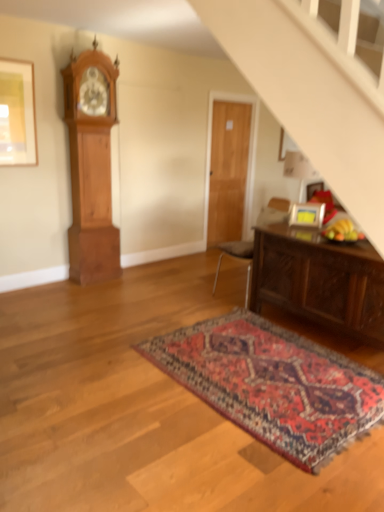
Question: Considering the relative positions of wooden grandfather clock at left and dark brown wooden table at lower right in the image provided, is wooden grandfather clock at left to the left of dark brown wooden table at lower right from the viewer's perspective?

Choices:
 (A) no
 (B) yes

Answer: (B)

Question: Is wooden grandfather clock at left completely or partially outside of dark brown wooden table at lower right?

Choices:
 (A) no
 (B) yes

Answer: (B)

Question: Is wooden grandfather clock at left far from dark brown wooden table at lower right?

Choices:
 (A) yes
 (B) no

Answer: (A)

Question: Does wooden grandfather clock at left have a larger size compared to dark brown wooden table at lower right?

Choices:
 (A) yes
 (B) no

Answer: (B)

Question: Is wooden grandfather clock at left aimed at dark brown wooden table at lower right?

Choices:
 (A) yes
 (B) no

Answer: (B)

Question: Looking at their shapes, would you say matte gold picture frame at upper left, positioned as the first picture frame in left-to-right order, is wider or thinner than dark brown wooden table at lower right?

Choices:
 (A) wide
 (B) thin

Answer: (B)

Question: From a real-world perspective, is matte gold picture frame at upper left, positioned as the first picture frame in left-to-right order, physically located above or below dark brown wooden table at lower right?

Choices:
 (A) below
 (B) above

Answer: (B)

Question: In terms of height, does matte gold picture frame at upper left, positioned as the first picture frame in left-to-right order, look taller or shorter compared to dark brown wooden table at lower right?

Choices:
 (A) tall
 (B) short

Answer: (A)

Question: Considering their positions, is matte gold picture frame at upper left, which appears as the 1th picture frame when viewed from the top, located in front of or behind dark brown wooden table at lower right?

Choices:
 (A) behind
 (B) front

Answer: (A)

Question: Is wooden door at center inside or outside of carpeted rug at center?

Choices:
 (A) inside
 (B) outside

Answer: (B)

Question: From the image's perspective, is wooden door at center located above or below carpeted rug at center?

Choices:
 (A) below
 (B) above

Answer: (B)

Question: Based on their positions, is wooden door at center located to the left or right of carpeted rug at center?

Choices:
 (A) left
 (B) right

Answer: (B)

Question: Is point (243, 199) closer or farther from the camera than point (317, 404)?

Choices:
 (A) closer
 (B) farther

Answer: (B)

Question: Do you think matte gold picture frame at upper left, marked as the 2th picture frame in a right-to-left arrangement, is within matte gold picture frame at upper right, the first picture frame from the bottom, or outside of it?

Choices:
 (A) inside
 (B) outside

Answer: (B)

Question: From the image's perspective, relative to matte gold picture frame at upper right, which is the first picture frame from right to left, is matte gold picture frame at upper left, which appears as the 1th picture frame when viewed from the top, above or below?

Choices:
 (A) below
 (B) above

Answer: (B)